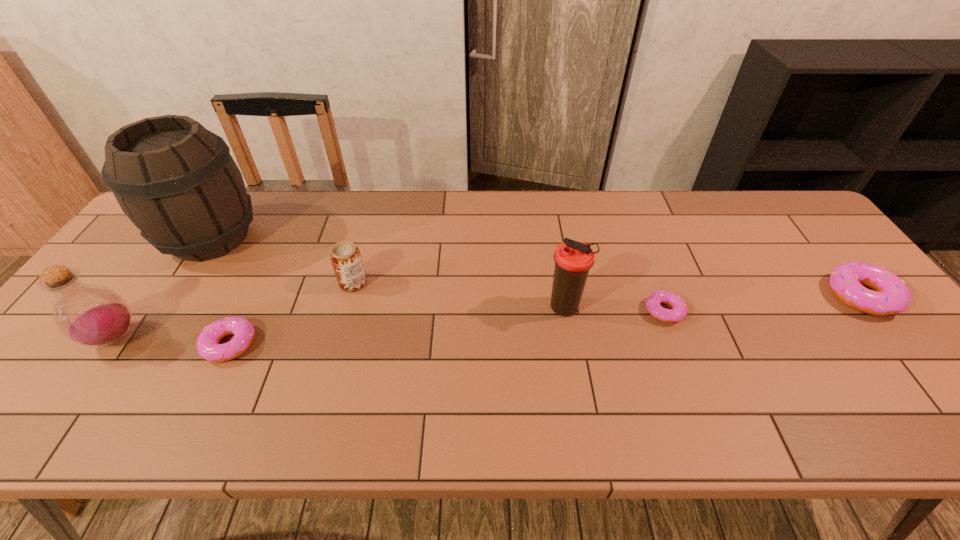
Locate an element on the screen. wine bucket situated at the left edge is located at coordinates (176, 181).

You are a GUI agent. You are given a task and a screenshot of the screen. Output one action in this format:
    pyautogui.click(x=<x>, y=<y>)
    Task: Click on the bottle that is at the left edge
    This screenshot has width=960, height=540.
    Given the screenshot: What is the action you would take?
    pyautogui.click(x=91, y=315)

This screenshot has height=540, width=960. Find the location of `object that is at the right edge`. object that is at the right edge is located at coordinates (891, 295).

This screenshot has height=540, width=960. What are the coordinates of `object present at the far left corner` in the screenshot? It's located at (176, 181).

Image resolution: width=960 pixels, height=540 pixels. I want to click on vacant area at the far edge, so click(611, 195).

Locate an element on the screen. vacant region at the near edge is located at coordinates 664,387.

At what (x,y) coordinates should I click in order to perform the action: click on free location at the right edge of the desktop. Please return your answer as a coordinate pair (x, y). Looking at the image, I should click on (894, 352).

Find the location of a particular element. vacant area at the near left corner of the desktop is located at coordinates (36, 388).

I want to click on vacant space at the far right corner of the desktop, so click(781, 210).

At what (x,y) coordinates should I click in order to perform the action: click on blank region between the second shortest object and the tallest object. Please return your answer as a coordinate pair (x, y). The image size is (960, 540). Looking at the image, I should click on (221, 291).